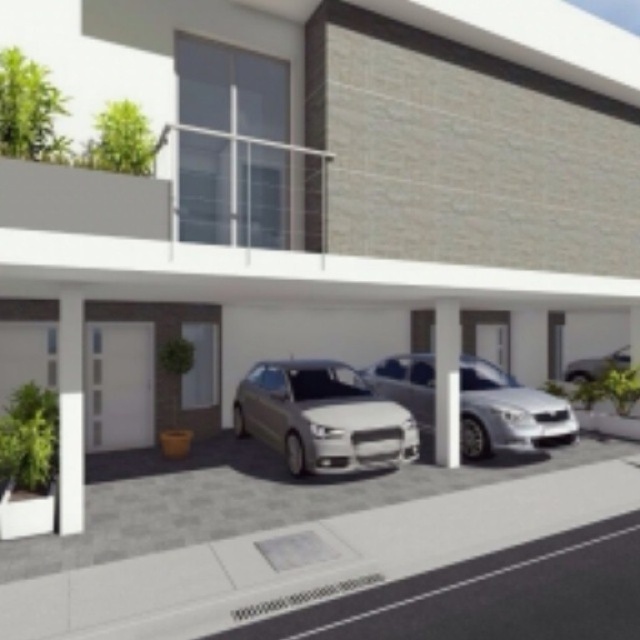
You are standing 15 meters away from the satin gold car at center. Can you see the entire car without moving your head?

The satin gold car at center and viewer are 10.35 meters apart from each other. Since you are standing 15 meters away, you are farther than the stated distance, so you might not be able to see the entire car without moving your head.

You are a delivery person trying to park your van, which is 3.6 meters long, in the carport. Both the satin gold car at center and the satin silver car at center are parked there. Can you fit your van between them without moving the cars?

The distance between the satin gold car at center and the satin silver car at center is 3.45 meters. Since your van is 3.6 meters long, it is slightly longer than the available space. Therefore, you cannot fit your van between them without moving the cars.